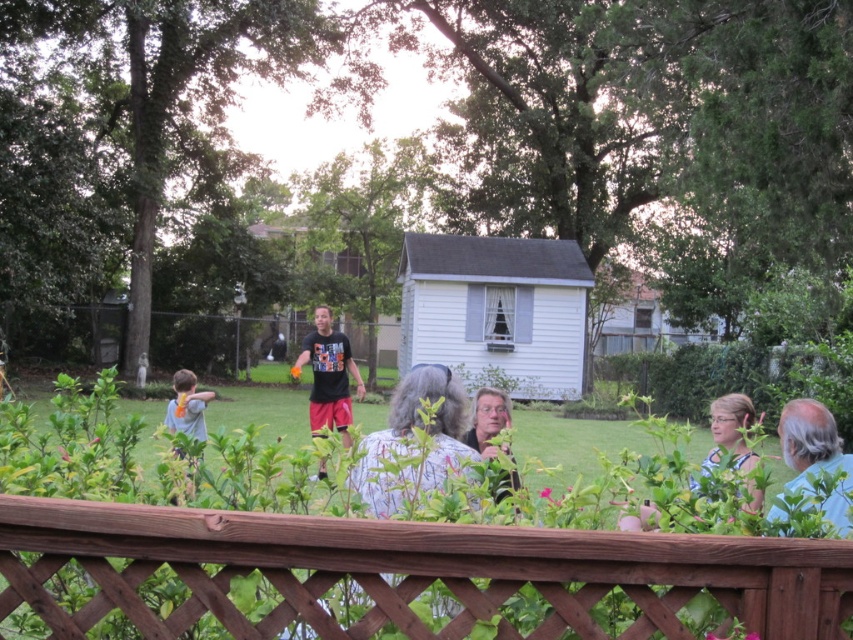
Is wooden fence at center shorter than light blue shirt at left?

No.

Who is taller, wooden fence at center or light blue shirt at left?

wooden fence at center

Is point (229, 369) less distant than point (173, 499)?

No, it is not.

The image size is (853, 640). Find the location of `wooden fence at center`. wooden fence at center is located at coordinates (222, 342).

Does brown wooden fence at lower center have a larger size compared to light blue shirt at left?

No, brown wooden fence at lower center is not bigger than light blue shirt at left.

Does brown wooden fence at lower center have a lesser width compared to light blue shirt at left?

Yes, brown wooden fence at lower center is thinner than light blue shirt at left.

Who is more distant from viewer, (546, 554) or (213, 394)?

Positioned behind is point (213, 394).

This screenshot has height=640, width=853. Identify the location of brown wooden fence at lower center. (415, 570).

Is brown wooden fence at lower center thinner than gray hair at upper right?

Incorrect, brown wooden fence at lower center's width is not less than gray hair at upper right's.

Looking at this image, does brown wooden fence at lower center come behind gray hair at upper right?

No, brown wooden fence at lower center is closer to the viewer.

Locate an element on the screen. The width and height of the screenshot is (853, 640). brown wooden fence at lower center is located at coordinates (415, 570).